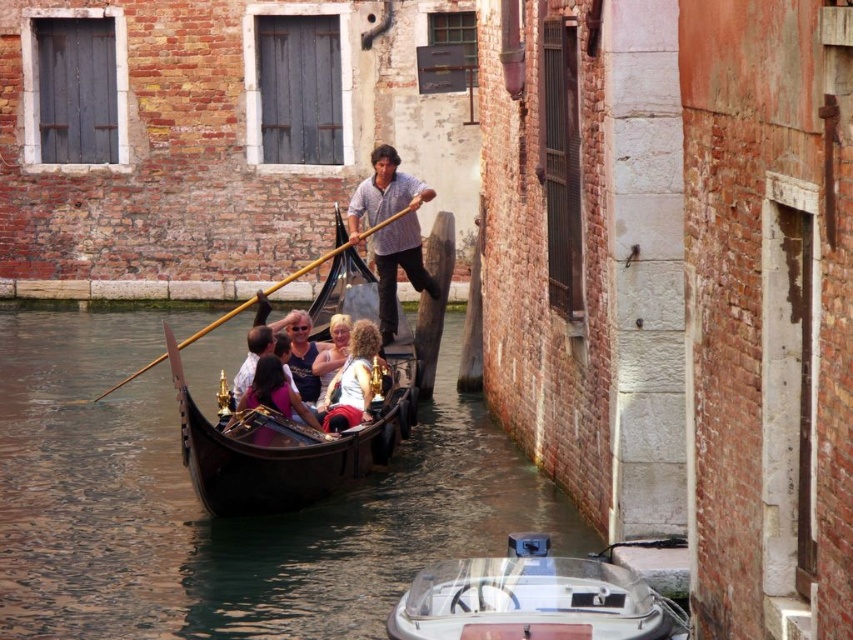
You are standing on the left bank of the canal and want to board the black polished wood gondola at center. Is the gondola positioned closer to the right bank or the left bank?

The black polished wood gondola at center is located at point coordinates indicating it is closer to the right bank since the x coordinate 0.698 is closer to 1.0 which represents the right side of the image.

You are standing on a bridge overlooking the canal and want to take a photo of the white glossy motorboat at center. The camera you are using has a maximum focus range of 100 feet. Will the motorboat be in focus?

The white glossy motorboat at center is 94.52 feet away from the camera, which is within the 100 feet maximum focus range. Therefore, the motorboat will be in focus.

You are standing on the edge of the canal in Venice and see both the white glossy motorboat at center and the matte blue tank top at center. Which object is closer to you?

The white glossy motorboat at center is 62.24 feet away from the matte blue tank top at center, so the distance between them is 62.24 feet. However, since both are at the center of the canal, their exact positions relative to your location on the edge cannot be determined without additional information about their placement along the canal.